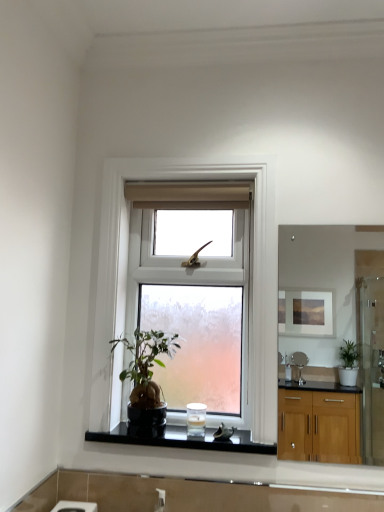
This screenshot has height=512, width=384. What do you see at coordinates (147, 371) in the screenshot? I see `green matte houseplant at center` at bounding box center [147, 371].

Describe the element at coordinates (338, 311) in the screenshot. Image resolution: width=384 pixels, height=512 pixels. I see `matte wooden mirror at upper right` at that location.

You are a GUI agent. You are given a task and a screenshot of the screen. Output one action in this format:
    pyautogui.click(x=<x>, y=<y>)
    Task: Click on the white frosted glass candle at center
    This screenshot has height=512, width=384.
    Given the screenshot: What is the action you would take?
    [196, 419]

What are the coordinates of `green matte houseplant at center` in the screenshot? It's located at (147, 371).

Can you confirm if black glossy stone at center is smaller than white frosted glass candle at center?

No, black glossy stone at center is not smaller than white frosted glass candle at center.

Is black glossy stone at center not within white frosted glass candle at center?

black glossy stone at center lies outside white frosted glass candle at center's area.

Which object is further away from the camera taking this photo, black glossy stone at center or white frosted glass candle at center?

white frosted glass candle at center is further from the camera.

From the image's perspective, who appears lower, white frosted glass candle at center or matte wooden mirror at upper right?

white frosted glass candle at center, from the image's perspective.

In terms of height, does white frosted glass candle at center look taller or shorter compared to matte wooden mirror at upper right?

Clearly, white frosted glass candle at center is shorter compared to matte wooden mirror at upper right.

Which is behind, point (200, 407) or point (363, 392)?

The point (363, 392) is farther from the camera.

Does black glossy stone at center come behind green matte houseplant at center?

Yes, black glossy stone at center is further from the viewer.

Between black glossy stone at center and green matte houseplant at center, which one has larger width?

With larger width is black glossy stone at center.

How different are the orientations of black glossy stone at center and green matte houseplant at center in degrees?

0.000317 degrees separate the facing orientations of black glossy stone at center and green matte houseplant at center.

Considering the points (134, 438) and (158, 389), which point is behind, point (134, 438) or point (158, 389)?

The point (158, 389) is farther.

Are green matte houseplant at center and black glossy stone at center beside each other?

They are not placed beside each other.

Does green matte houseplant at center have a larger size compared to black glossy stone at center?

Indeed, green matte houseplant at center has a larger size compared to black glossy stone at center.

Does green matte houseplant at center have a lesser width compared to black glossy stone at center?

Correct, the width of green matte houseplant at center is less than that of black glossy stone at center.

Is green matte houseplant at center further to camera compared to black glossy stone at center?

No, it is in front of black glossy stone at center.

Is white frosted glass candle at center thinner than green matte houseplant at center?

Indeed, white frosted glass candle at center has a lesser width compared to green matte houseplant at center.

Who is more distant, white frosted glass candle at center or green matte houseplant at center?

white frosted glass candle at center is further away from the camera.

From a real-world perspective, is white frosted glass candle at center on green matte houseplant at center?

No.

Where is `houseplant on the left of the white frosted glass candle at center`? The image size is (384, 512). houseplant on the left of the white frosted glass candle at center is located at coordinates (147, 371).

Considering the relative positions of matte wooden mirror at upper right and clear glass window at center in the image provided, is matte wooden mirror at upper right to the right of clear glass window at center from the viewer's perspective?

Yes, matte wooden mirror at upper right is to the right of clear glass window at center.

Between matte wooden mirror at upper right and clear glass window at center, which one has larger width?

clear glass window at center.

From the image's perspective, is matte wooden mirror at upper right beneath clear glass window at center?

Indeed, from the image's perspective, matte wooden mirror at upper right is shown beneath clear glass window at center.

Which of these two, matte wooden mirror at upper right or clear glass window at center, stands shorter?

matte wooden mirror at upper right is shorter.

Could you tell me if matte wooden mirror at upper right is facing black glossy stone at center?

No, matte wooden mirror at upper right is not aimed at black glossy stone at center.

Which of these two, matte wooden mirror at upper right or black glossy stone at center, is bigger?

Bigger between the two is matte wooden mirror at upper right.

Considering the positions of points (328, 311) and (230, 440), is point (328, 311) farther from camera compared to point (230, 440)?

Yes, point (328, 311) is behind point (230, 440).

From a real-world perspective, is matte wooden mirror at upper right below black glossy stone at center?

No.

Locate an element on the screen. The image size is (384, 512). appliance above the black glossy stone at center (from a real-world perspective) is located at coordinates (196, 419).

I want to click on appliance that appears below the matte wooden mirror at upper right (from the image's perspective), so click(196, 419).

Based on their spatial positions, is matte wooden mirror at upper right or white frosted glass candle at center closer to black glossy stone at center?

Among the two, white frosted glass candle at center is located nearer to black glossy stone at center.

When comparing their distances from matte wooden mirror at upper right, does black glossy stone at center or green matte houseplant at center seem closer?

green matte houseplant at center is closer to matte wooden mirror at upper right.

When comparing their distances from clear glass window at center, does green matte houseplant at center or matte wooden mirror at upper right seem closer?

green matte houseplant at center lies closer to clear glass window at center than the other object.

Considering their positions, is matte wooden mirror at upper right positioned further to white frosted glass candle at center than green matte houseplant at center?

Among the two, matte wooden mirror at upper right is located further to white frosted glass candle at center.

Which object lies further to the anchor point white frosted glass candle at center, clear glass window at center or black glossy stone at center?

Among the two, clear glass window at center is located further to white frosted glass candle at center.

From the image, which object appears to be farther from clear glass window at center, matte wooden mirror at upper right or white frosted glass candle at center?

Among the two, matte wooden mirror at upper right is located further to clear glass window at center.

From the image, which object appears to be farther from white frosted glass candle at center, matte wooden mirror at upper right or clear glass window at center?

The object further to white frosted glass candle at center is matte wooden mirror at upper right.

Based on their spatial positions, is black glossy stone at center or clear glass window at center closer to matte wooden mirror at upper right?

black glossy stone at center is closer to matte wooden mirror at upper right.

Find the location of a particular element. The height and width of the screenshot is (512, 384). window situated between black glossy stone at center and matte wooden mirror at upper right from left to right is located at coordinates (126, 272).

The image size is (384, 512). I want to click on window sill situated between green matte houseplant at center and matte wooden mirror at upper right from left to right, so [x=180, y=438].

Where is `houseplant between clear glass window at center and black glossy stone at center vertically`? This screenshot has height=512, width=384. houseplant between clear glass window at center and black glossy stone at center vertically is located at coordinates (147, 371).

Locate an element on the screen. This screenshot has width=384, height=512. window between green matte houseplant at center and matte wooden mirror at upper right from left to right is located at coordinates (126, 272).